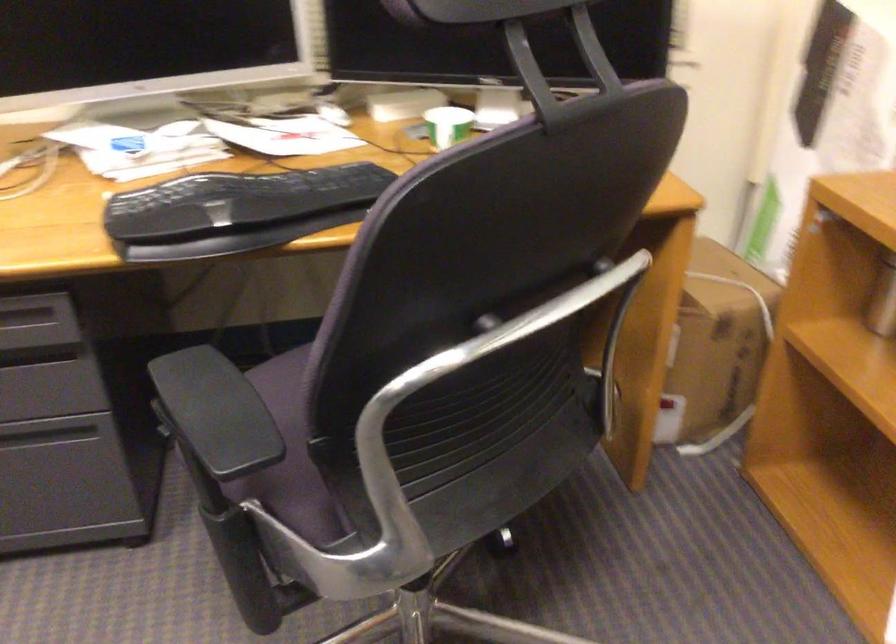
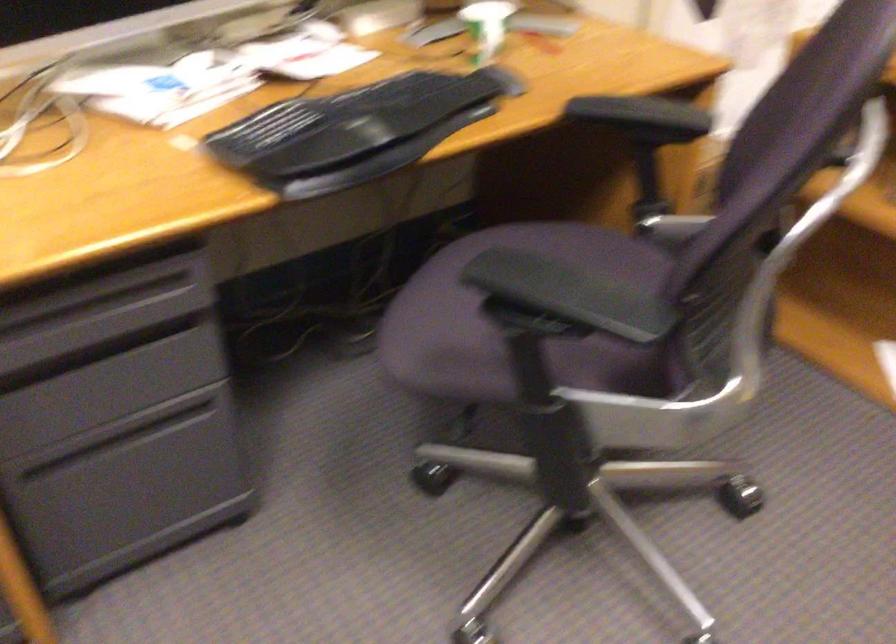
Find the pixel in the second image that matches [201,404] in the first image.

(564, 289)